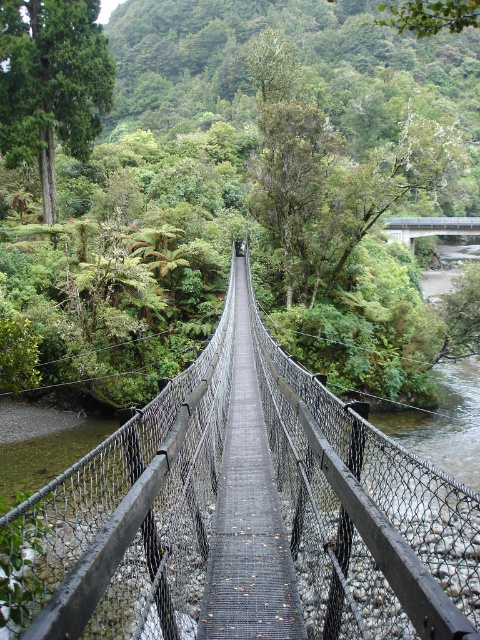
Question: Can you confirm if wooden mesh bridge at center is wider than metallic gray bridge at center?

Choices:
 (A) no
 (B) yes

Answer: (A)

Question: Which point appears farthest from the camera in this image?

Choices:
 (A) (405, 232)
 (B) (323, 420)

Answer: (A)

Question: Can you confirm if wooden mesh bridge at center is wider than metallic gray bridge at center?

Choices:
 (A) yes
 (B) no

Answer: (B)

Question: Can you confirm if wooden mesh bridge at center is positioned below metallic gray bridge at center?

Choices:
 (A) yes
 (B) no

Answer: (A)